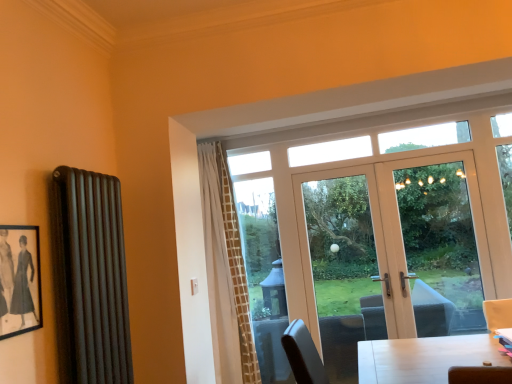
Question: From a real-world perspective, is matte black radiator at left located higher than white glossy door at center?

Choices:
 (A) yes
 (B) no

Answer: (A)

Question: Is matte black radiator at left facing towards white glossy door at center?

Choices:
 (A) no
 (B) yes

Answer: (A)

Question: Considering the relative positions of matte black radiator at left and white glossy door at center in the image provided, is matte black radiator at left to the right of white glossy door at center from the viewer's perspective?

Choices:
 (A) no
 (B) yes

Answer: (A)

Question: Is matte black radiator at left further to the viewer compared to white glossy door at center?

Choices:
 (A) no
 (B) yes

Answer: (A)

Question: From the image's perspective, is matte black radiator at left beneath white glossy door at center?

Choices:
 (A) no
 (B) yes

Answer: (A)

Question: Considering the positions of matte black radiator at left and white glossy door at center in the image, is matte black radiator at left bigger or smaller than white glossy door at center?

Choices:
 (A) big
 (B) small

Answer: (B)

Question: From the image's perspective, relative to white glossy door at center, is matte black radiator at left above or below?

Choices:
 (A) above
 (B) below

Answer: (A)

Question: From a real-world perspective, is matte black radiator at left physically located above or below white glossy door at center?

Choices:
 (A) below
 (B) above

Answer: (B)

Question: Is point [x=96, y=274] positioned closer to the camera than point [x=302, y=198]?

Choices:
 (A) farther
 (B) closer

Answer: (B)

Question: In terms of height, does white glossy door at center look taller or shorter compared to black matte picture frame at left?

Choices:
 (A) tall
 (B) short

Answer: (A)

Question: From the image's perspective, relative to black matte picture frame at left, is white glossy door at center above or below?

Choices:
 (A) above
 (B) below

Answer: (B)

Question: Is white glossy door at center to the left or to the right of black matte picture frame at left in the image?

Choices:
 (A) right
 (B) left

Answer: (A)

Question: From a real-world perspective, relative to black matte picture frame at left, is white glossy door at center vertically above or below?

Choices:
 (A) below
 (B) above

Answer: (A)

Question: In the image, is black matte picture frame at left on the left side or the right side of transparent glass door at center, the 1th window screen viewed from the front?

Choices:
 (A) right
 (B) left

Answer: (B)

Question: Relative to transparent glass door at center, the second window screen positioned from the back, is black matte picture frame at left in front or behind?

Choices:
 (A) behind
 (B) front

Answer: (B)